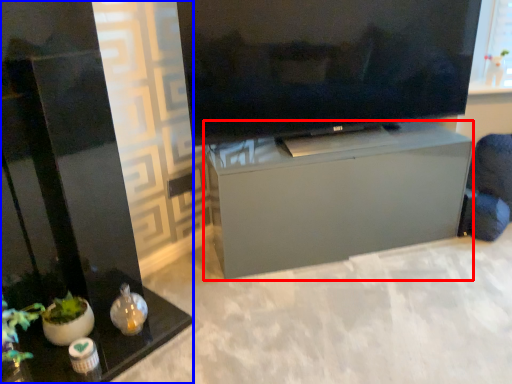
Question: Which of the following is the farthest to the observer, furniture (highlighted by a red box) or furniture (highlighted by a blue box)?

Choices:
 (A) furniture
 (B) furniture

Answer: (A)